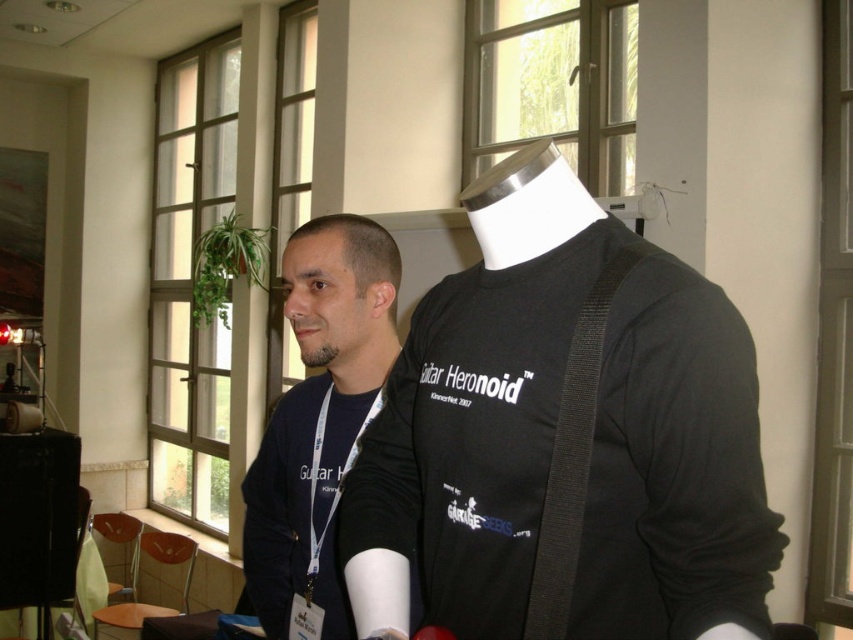
Question: Which of the following is the closest to the observer?

Choices:
 (A) black matte shirt at center
 (B) matte black shirt at center

Answer: (A)

Question: Is black matte shirt at center above matte black shirt at center?

Choices:
 (A) no
 (B) yes

Answer: (B)

Question: From the image, what is the correct spatial relationship of black matte shirt at center in relation to matte black shirt at center?

Choices:
 (A) right
 (B) left

Answer: (A)

Question: Is black matte shirt at center below matte black shirt at center?

Choices:
 (A) no
 (B) yes

Answer: (A)